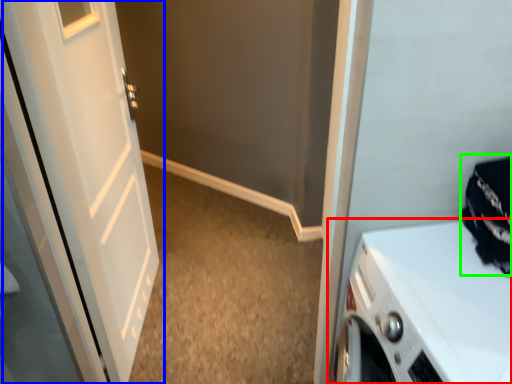
Question: Estimate the real-world distances between objects in this image. Which object is farther from home appliance (highlighted by a red box), door (highlighted by a blue box) or clothing (highlighted by a green box)?

Choices:
 (A) door
 (B) clothing

Answer: (A)